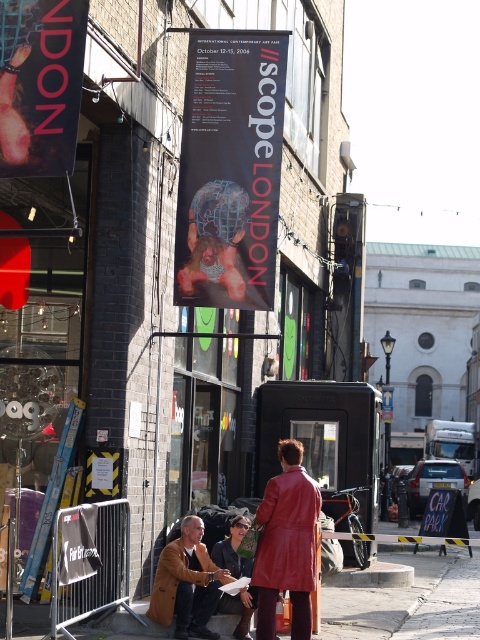
You are a fashion designer observing an urban street scene in London. You notice a leather coat at center and a red leather trench coat at lower center. Which coat is located to the right of the other?

The leather coat at center is positioned on the right side of red leather trench coat at lower center.

You are standing on the street looking at the building with the SCOPE LONDON banner. There are two points marked on the image at coordinates point (284, 99) and point (2, 150). Which point is closer to you?

Point (284, 99) is further to the viewer than point (2, 150), so the point closer to you is point (2, 150).

You are an art collector standing in the middle of the street looking at the black matte poster at center and the leather jacket at center. Which object is closer to you?

The black matte poster at center is closer to you because the leather jacket at center is behind it.